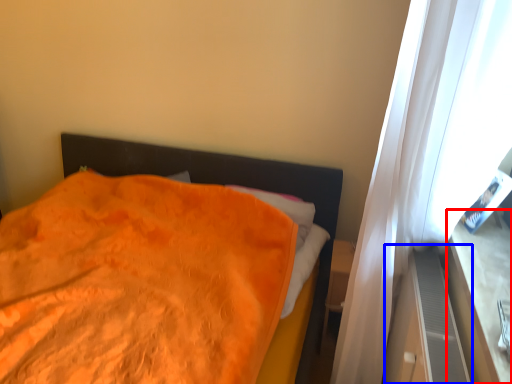
Question: Which of the following is the closest to the observer, window sill (highlighted by a red box) or dresser (highlighted by a blue box)?

Choices:
 (A) window sill
 (B) dresser

Answer: (A)